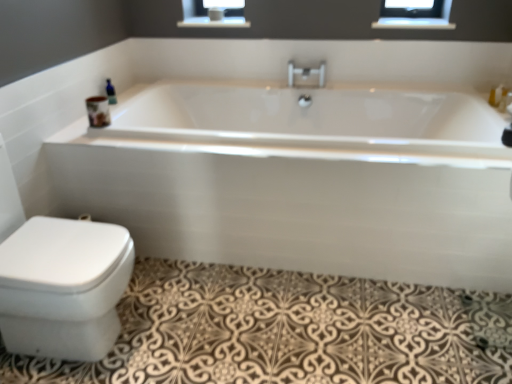
Question: From the image's perspective, is white glossy bathtub at center under blue glass bottle at upper left?

Choices:
 (A) yes
 (B) no

Answer: (A)

Question: Could you tell me if white glossy bathtub at center is turned towards blue glass bottle at upper left?

Choices:
 (A) no
 (B) yes

Answer: (A)

Question: From the image's perspective, is white glossy bathtub at center on blue glass bottle at upper left?

Choices:
 (A) no
 (B) yes

Answer: (A)

Question: Is white glossy bathtub at center smaller than blue glass bottle at upper left?

Choices:
 (A) yes
 (B) no

Answer: (B)

Question: Is white glossy bathtub at center oriented away from blue glass bottle at upper left?

Choices:
 (A) yes
 (B) no

Answer: (B)

Question: Visually, is clear glass balustrade at upper center positioned to the left or to the right of white glossy bidet at lower left?

Choices:
 (A) right
 (B) left

Answer: (A)

Question: Is point (395, 18) positioned closer to the camera than point (11, 279)?

Choices:
 (A) closer
 (B) farther

Answer: (B)

Question: Is clear glass balustrade at upper center situated inside white glossy bidet at lower left or outside?

Choices:
 (A) inside
 (B) outside

Answer: (B)

Question: Relative to white glossy bidet at lower left, is clear glass balustrade at upper center in front or behind?

Choices:
 (A) behind
 (B) front

Answer: (A)

Question: From a real-world perspective, is clear glass balustrade at upper center physically located above or below brown textured bath mat at lower left?

Choices:
 (A) below
 (B) above

Answer: (B)

Question: Would you say clear glass balustrade at upper center is inside or outside brown textured bath mat at lower left?

Choices:
 (A) inside
 (B) outside

Answer: (B)

Question: Based on their sizes in the image, would you say clear glass balustrade at upper center is bigger or smaller than brown textured bath mat at lower left?

Choices:
 (A) big
 (B) small

Answer: (B)

Question: Considering the positions of clear glass balustrade at upper center and brown textured bath mat at lower left in the image, is clear glass balustrade at upper center taller or shorter than brown textured bath mat at lower left?

Choices:
 (A) short
 (B) tall

Answer: (A)

Question: Would you say blue glass bottle at upper left is inside or outside white glossy bathtub at center?

Choices:
 (A) inside
 (B) outside

Answer: (B)

Question: From a real-world perspective, is blue glass bottle at upper left physically located above or below white glossy bathtub at center?

Choices:
 (A) below
 (B) above

Answer: (B)